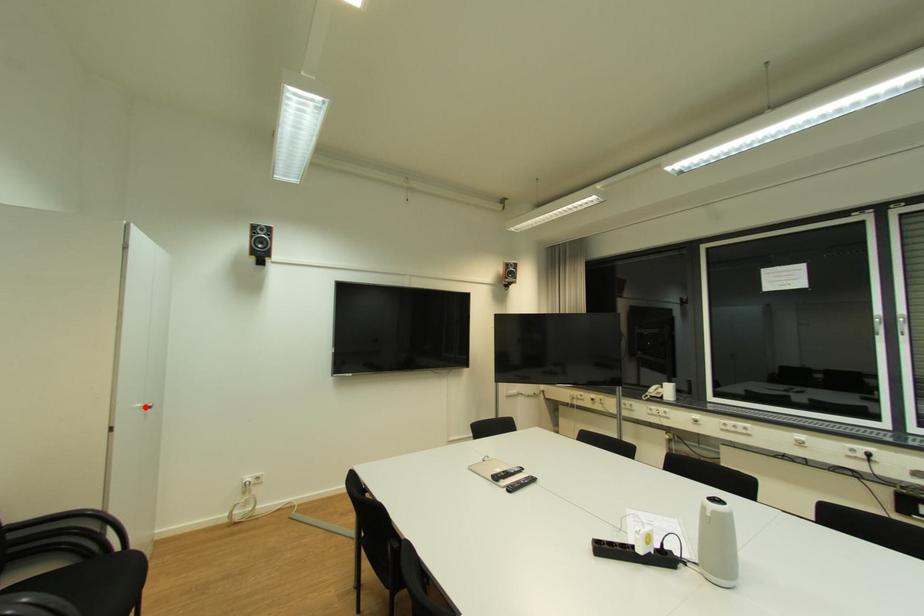
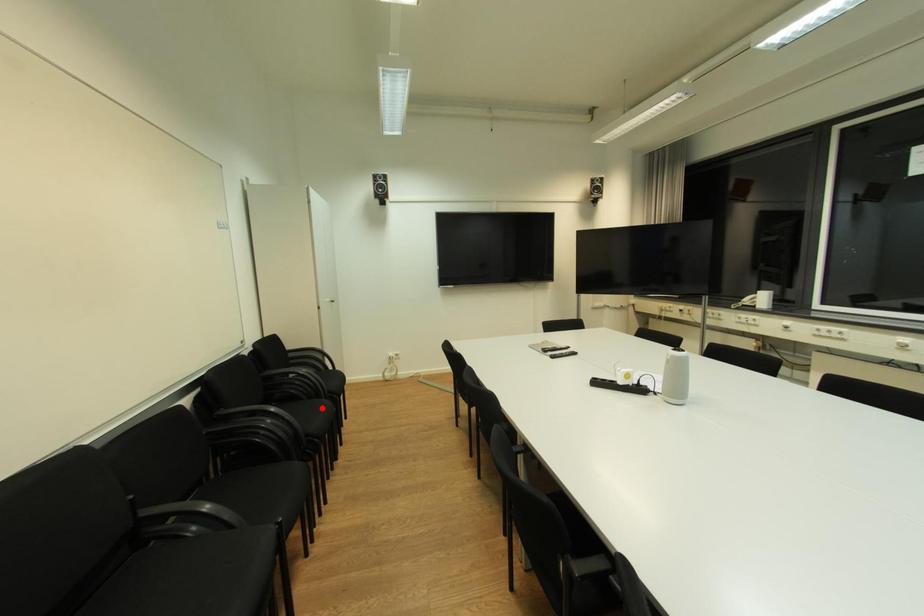
I am providing you with two images of the same scene from different viewpoints. A red point is marked on the first image and another point is marked on the second image. Do the highlighted points in image1 and image2 indicate the same real-world spot?

No